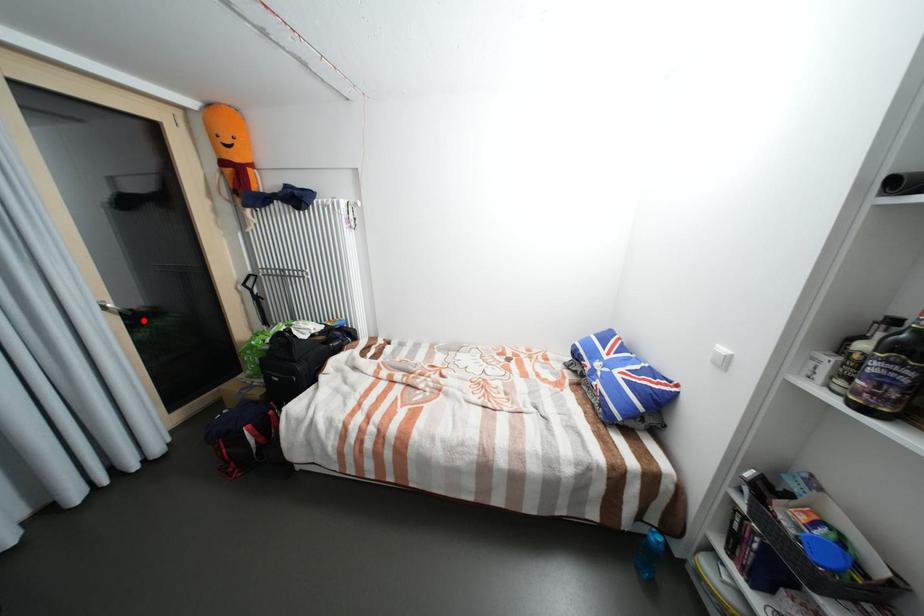
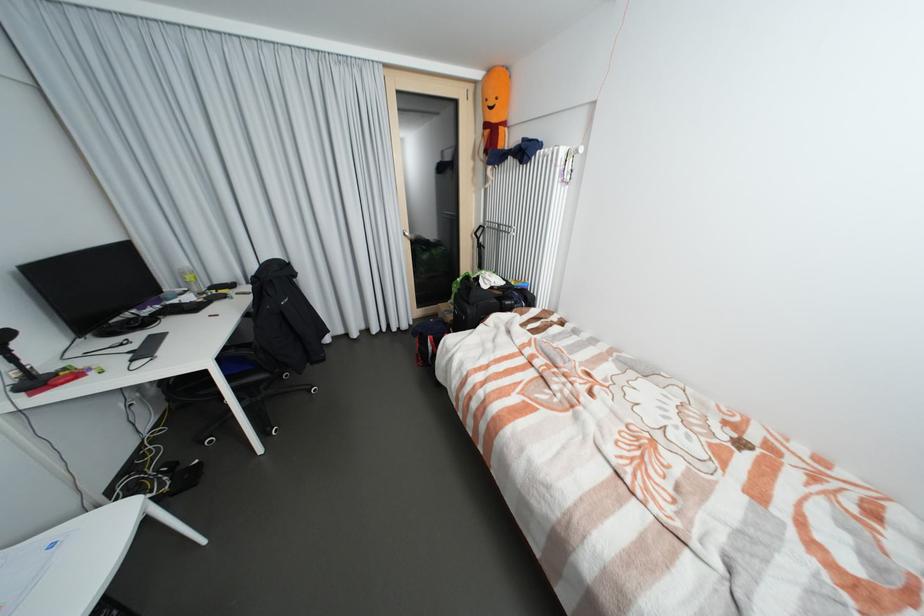
Question: A red point is marked in image1. In image2, is the corresponding 3D point closer to the camera or farther? Reply with the corresponding letter.

Choices:
 (A) The corresponding 3D point is closer.
 (B) The corresponding 3D point is farther.

Answer: (A)